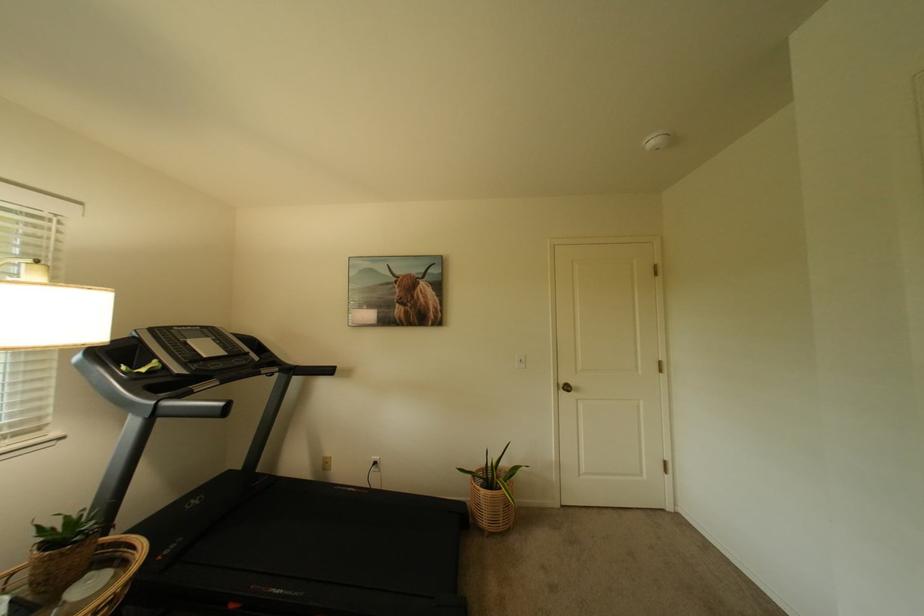
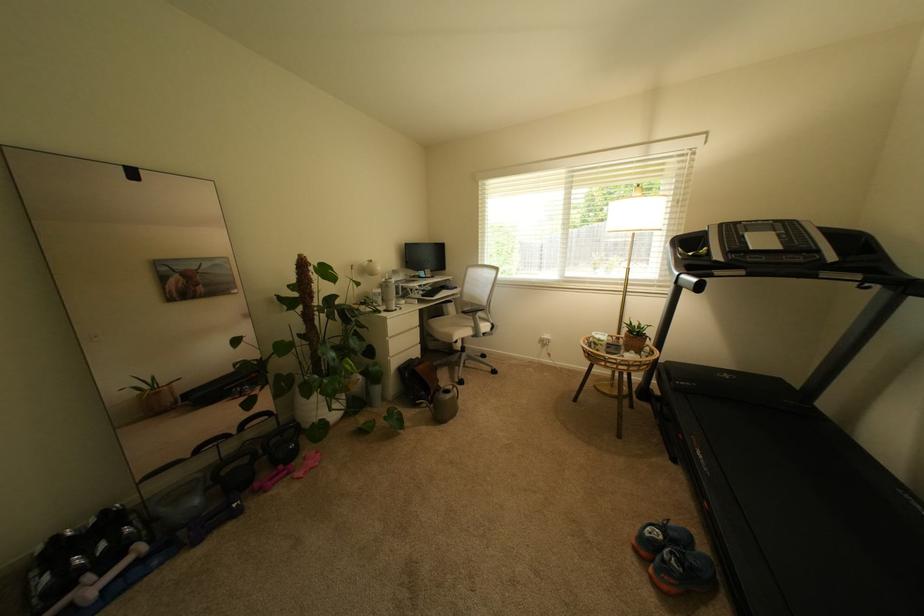
Where in the second image is the point corresponding to (x=169, y=413) from the first image?

(688, 283)